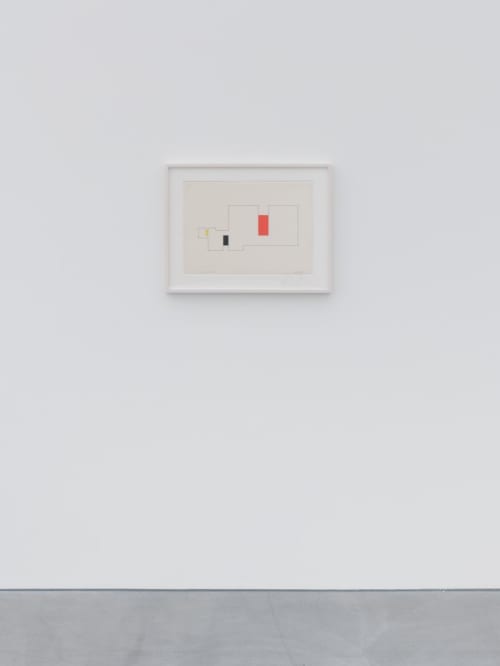
The image size is (500, 666). In order to click on wall to right of frame in this screenshot , I will do `click(420, 282)`.